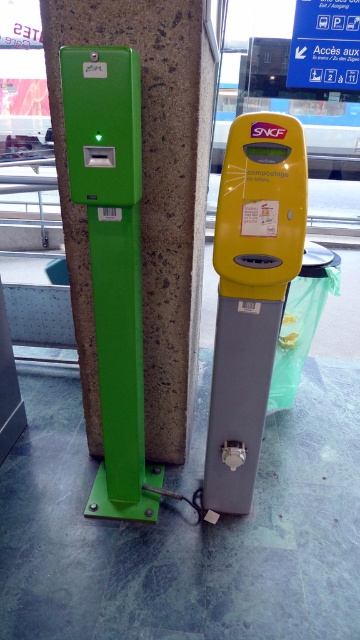
Who is positioned more to the left, green plastic card reader at left or yellow plastic parking meter at center?

Positioned to the left is green plastic card reader at left.

Is point (145, 189) less distant than point (223, 358)?

No, it is not.

Who is more forward, (83, 36) or (270, 314)?

Point (83, 36)

This screenshot has height=640, width=360. What are the coordinates of `green plastic card reader at left` in the screenshot? It's located at (146, 198).